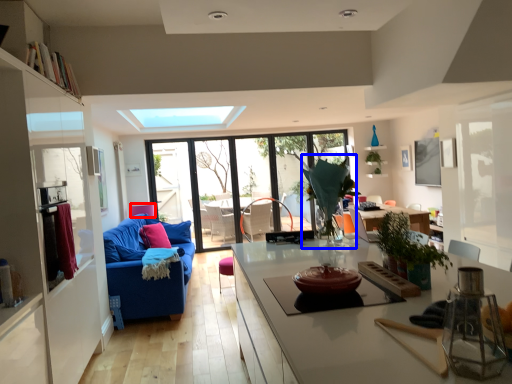
Question: Which point is further to the camera, armchair (highlighted by a red box) or plant (highlighted by a blue box)?

Choices:
 (A) armchair
 (B) plant

Answer: (A)